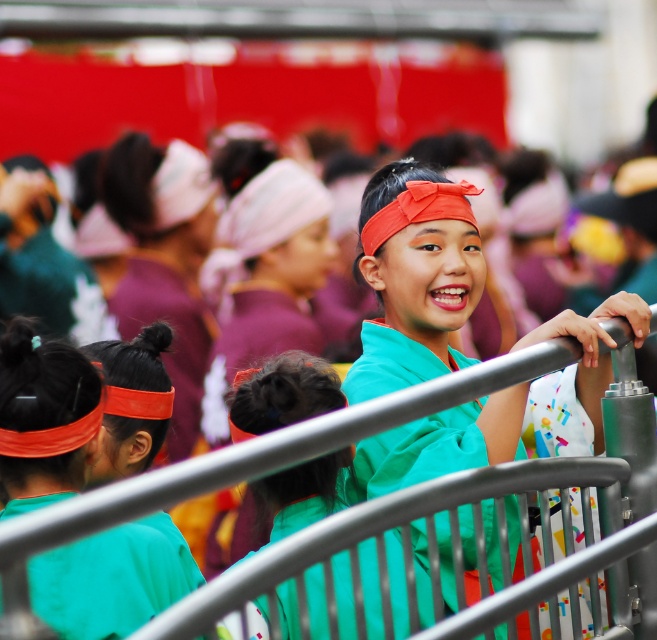
Question: Can you confirm if matte green shirt at center is positioned to the right of matte orange headband at left?

Choices:
 (A) yes
 (B) no

Answer: (A)

Question: Does matte green shirt at center lie behind matte orange headband at left?

Choices:
 (A) yes
 (B) no

Answer: (B)

Question: Considering the relative positions of matte green shirt at center and matte orange headband at left in the image provided, where is matte green shirt at center located with respect to matte orange headband at left?

Choices:
 (A) right
 (B) left

Answer: (A)